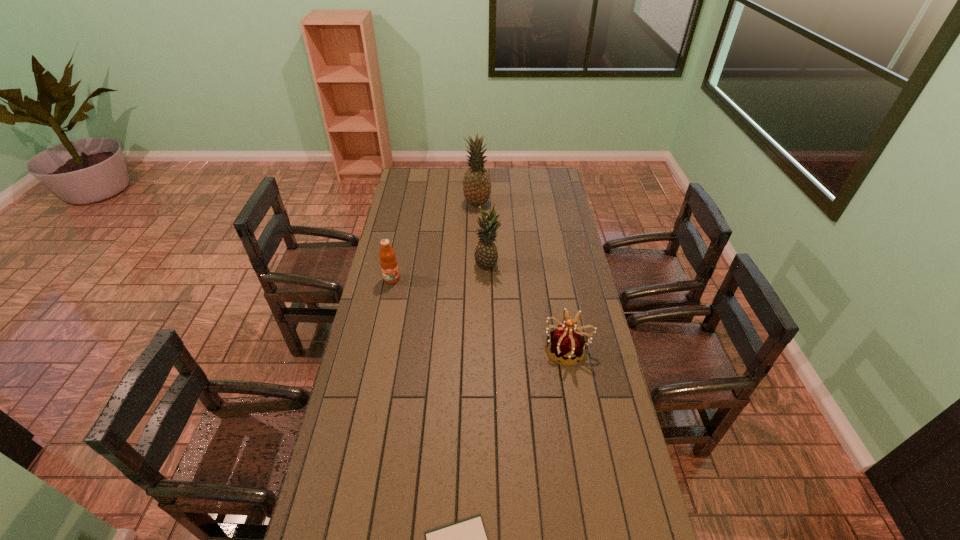
The width and height of the screenshot is (960, 540). Find the location of `free spot between the taller pineapple and the third farthest object`. free spot between the taller pineapple and the third farthest object is located at coordinates (435, 241).

Locate an element on the screen. The height and width of the screenshot is (540, 960). free point between the fourth shortest object and the tiara is located at coordinates (527, 306).

What are the coordinates of `vacant space that is in between the tiara and the nearer pineapple` in the screenshot? It's located at pos(527,306).

Find the location of a particular element. This screenshot has width=960, height=540. free spot between the taller pineapple and the leftmost object is located at coordinates (435, 241).

Image resolution: width=960 pixels, height=540 pixels. What are the coordinates of `free space between the taller pineapple and the third nearest object` in the screenshot? It's located at [x=435, y=241].

I want to click on free space between the farthest object and the rightmost object, so click(522, 276).

Where is `free space between the leftmost object and the fourth shortest object`? This screenshot has height=540, width=960. free space between the leftmost object and the fourth shortest object is located at coordinates (440, 271).

Identify the location of the third closest object to the nearest object. (486, 255).

At what (x,y) coordinates should I click in order to perform the action: click on object that is the third closest to the hardback book. Please return your answer as a coordinate pair (x, y). The width and height of the screenshot is (960, 540). Looking at the image, I should click on (486, 255).